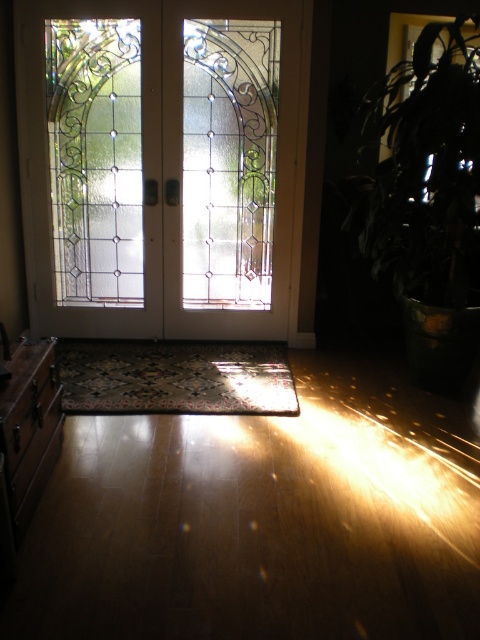
You are standing in the entrance hall and want to exit through the clear glass doors at center. Which direction should you move relative to the carpeted mat at center?

You should move to the right of the carpeted mat at center to reach the clear glass doors at center, as they are located to the right of the mat.

You are standing in the entrance hall and want to move from the dark green leafy plant at right to the clear glass doors at center. In which direction should you walk?

The clear glass doors at center is positioned on the left side of dark green leafy plant at right, so you should walk to the left to reach the clear glass doors at center from the dark green leafy plant at right.

You are standing in the entrance hall and want to exit through the clear glass doors at center. According to the provided coordinates, where exactly should you walk to reach them?

The clear glass doors at center are located at coordinates point (163, 164), so you should walk towards that point to reach them.